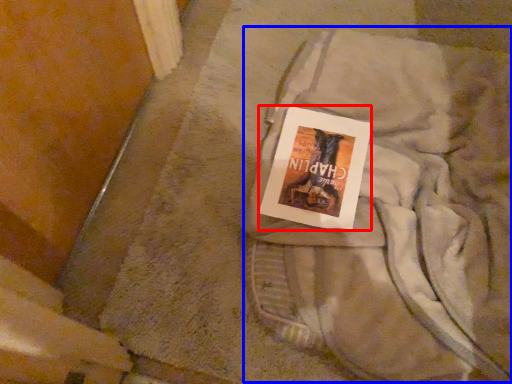
Question: Which object is closer to the camera taking this photo, paperback book (highlighted by a red box) or laundry (highlighted by a blue box)?

Choices:
 (A) paperback book
 (B) laundry

Answer: (B)